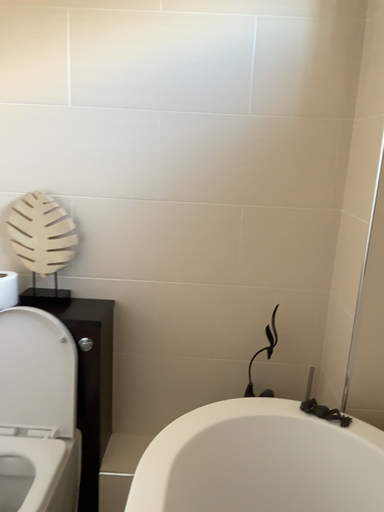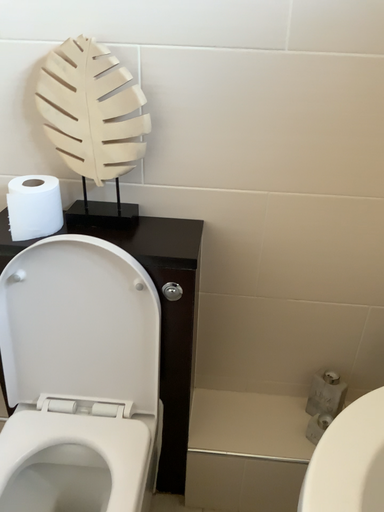
Question: How did the camera likely rotate when shooting the video?

Choices:
 (A) rotated downward
 (B) rotated upward

Answer: (A)